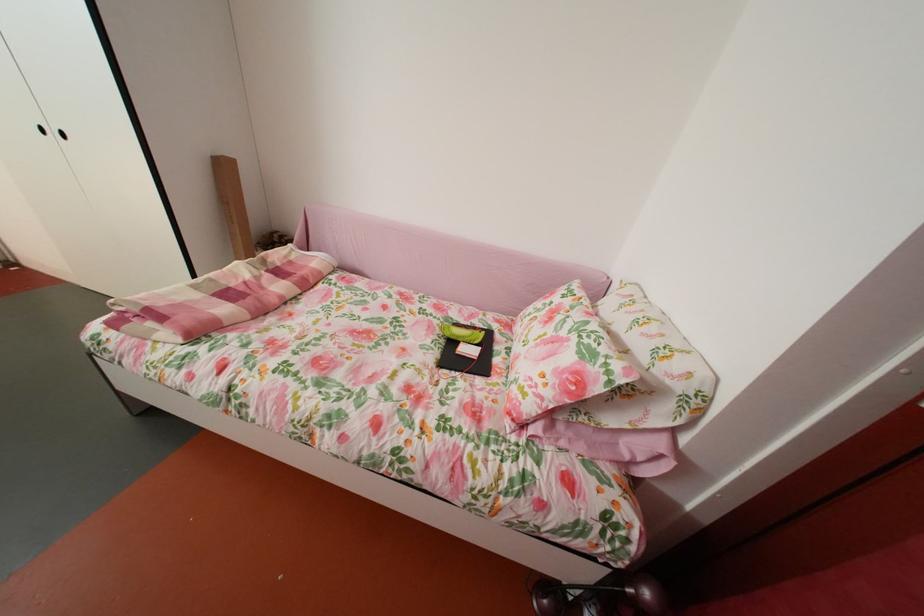
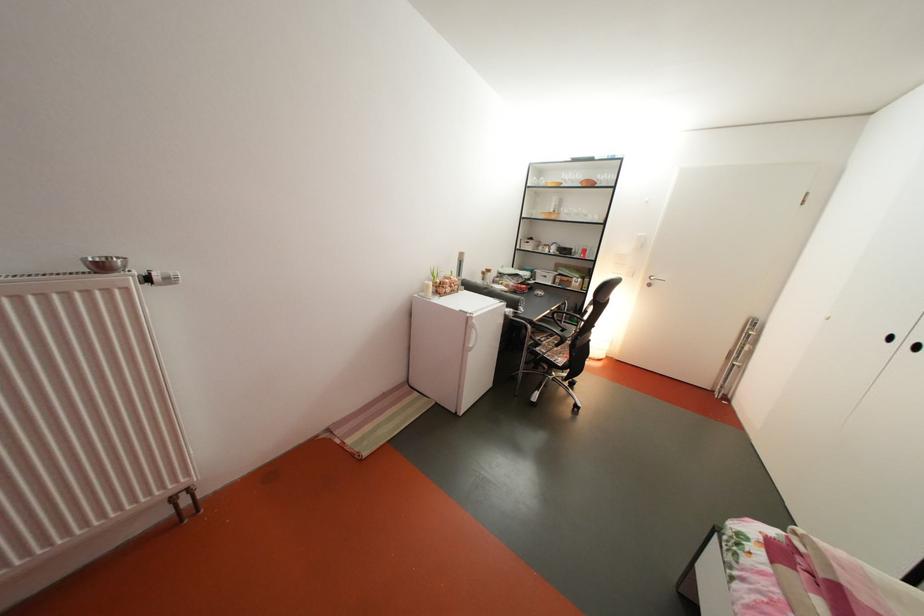
From the picture: First-person continuous shooting, in which direction is the camera rotating?

The camera's rotation is toward left-down.